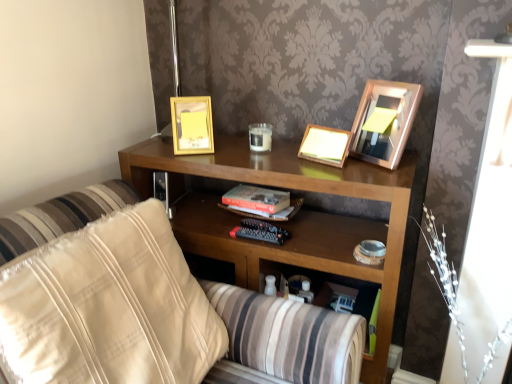
Locate an element on the screen. The height and width of the screenshot is (384, 512). free point to the right of wooden picture frame at center, which is counted as the 2th picture frame, starting from the left is located at coordinates (377, 164).